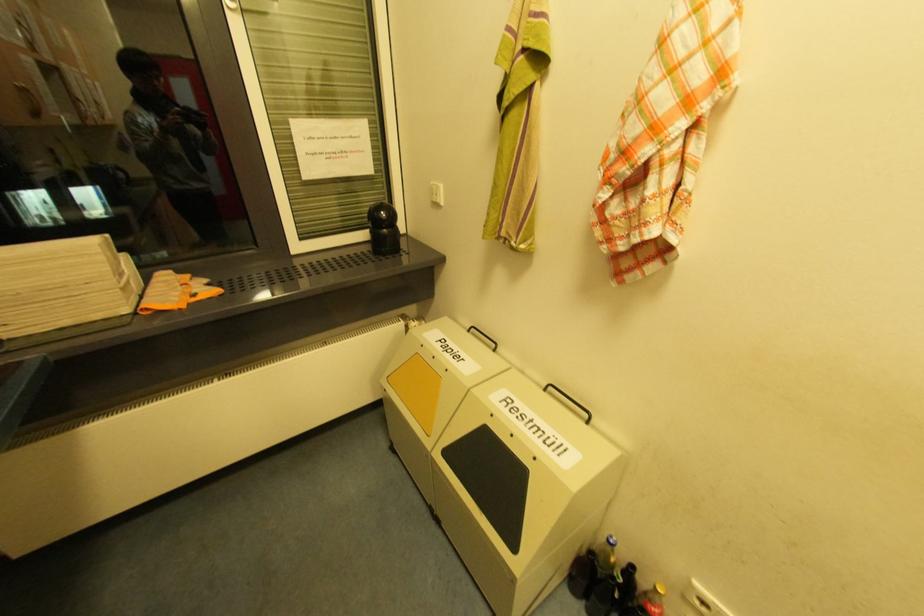
Find where to lift the small black object. Please return your answer as a coordinate pair (x, y).

(383, 229)